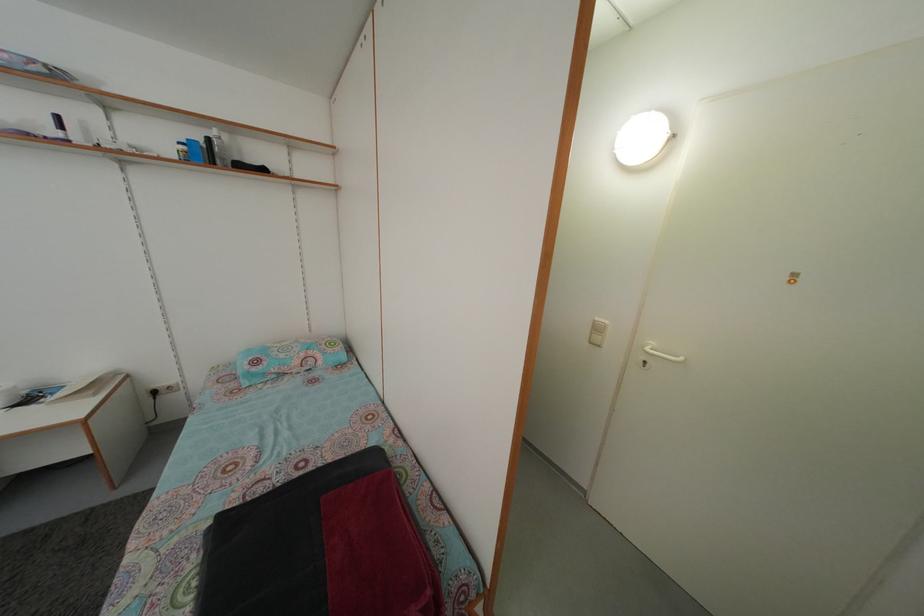
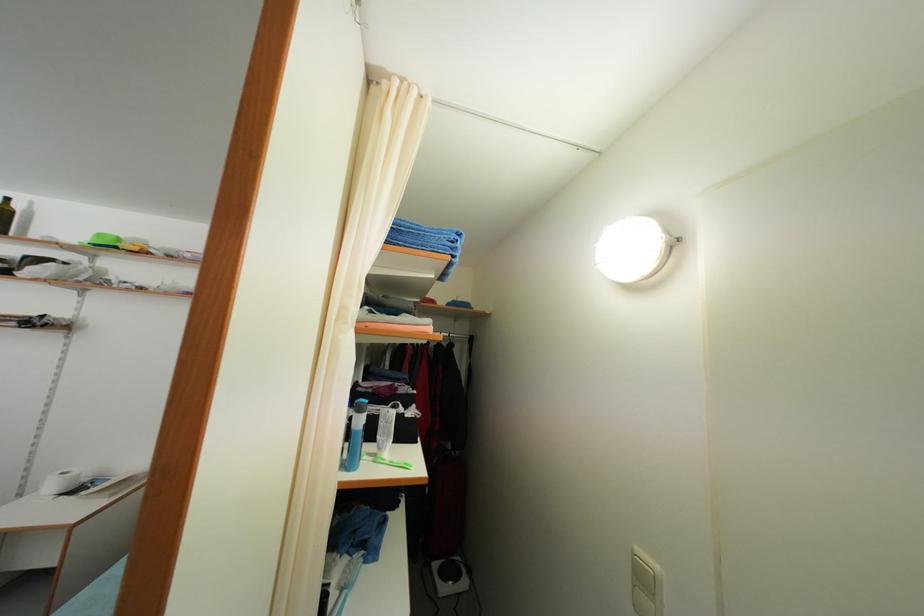
Question: I am providing you with two images of the same scene from different viewpoints. Please identify which objects are invisible in image2.

Choices:
 (A) floral toilet lid
 (B) clear plastic container
 (C) transparent bottle
 (D) green toothbrush

Answer: (C)